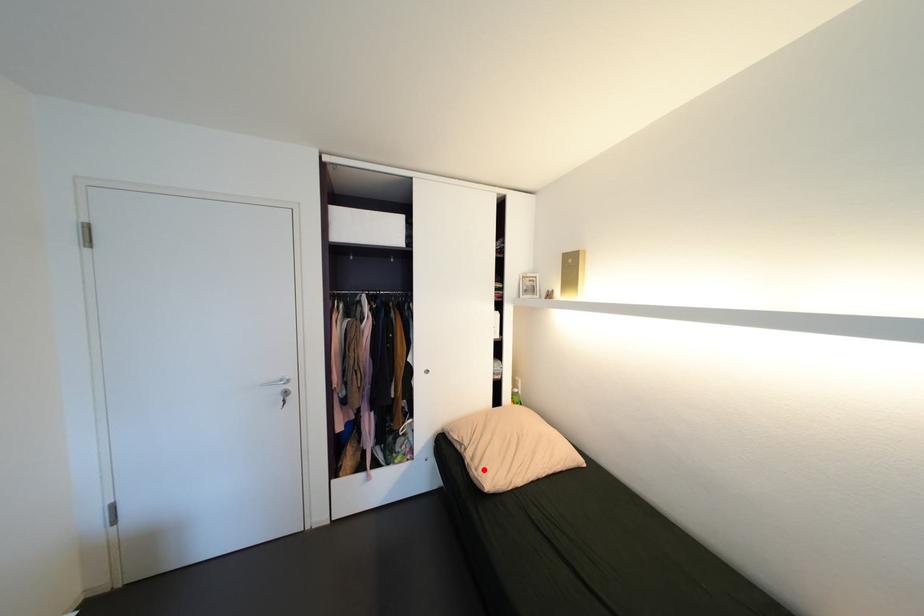
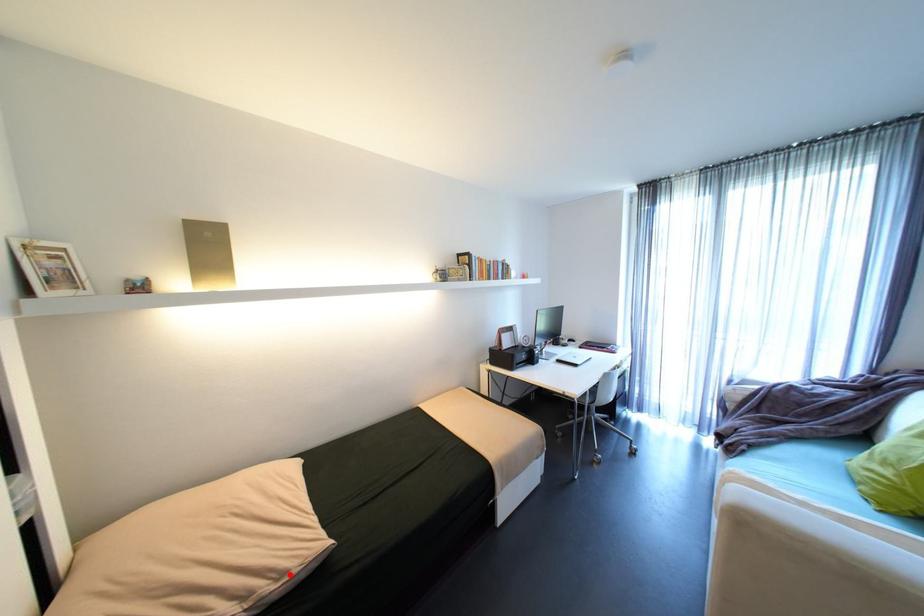
I am providing you with two images of the same scene from different viewpoints. A red point is marked on the first image and another point is marked on the second image. Do the highlighted points in image1 and image2 indicate the same real-world spot?

Yes